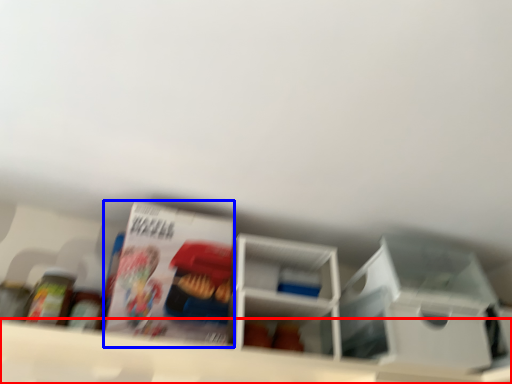
Question: Which of the following is the farthest to the observer, shelf (highlighted by a red box) or magazine (highlighted by a blue box)?

Choices:
 (A) shelf
 (B) magazine

Answer: (B)